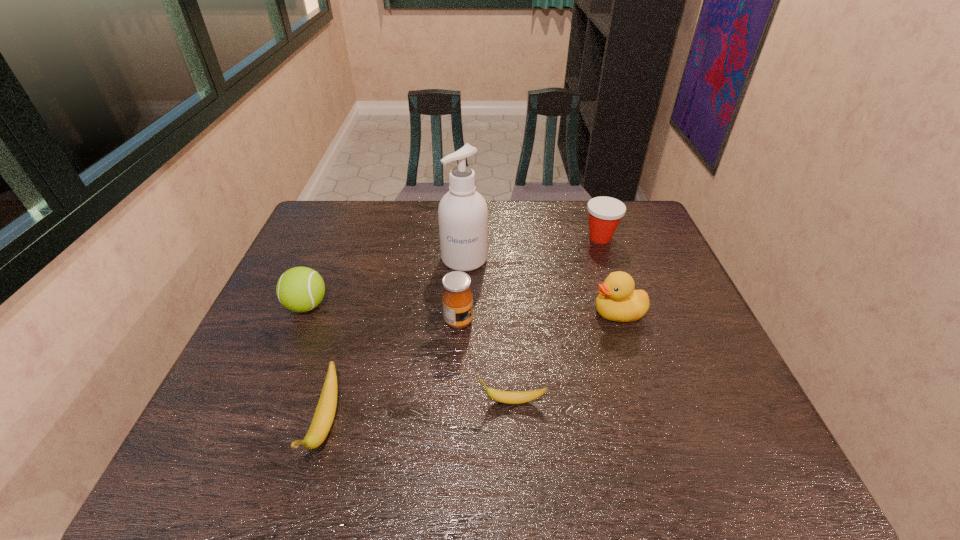
Locate an element on the screen. The height and width of the screenshot is (540, 960). object that is at the left edge is located at coordinates 299,289.

Locate an element on the screen. Dixie cup positioned at the right edge is located at coordinates (605, 213).

I want to click on duck that is at the right edge, so click(x=617, y=301).

The width and height of the screenshot is (960, 540). In order to click on object that is at the far right corner in this screenshot , I will do `click(605, 213)`.

Where is `vacant space at the far edge of the desktop`? The height and width of the screenshot is (540, 960). vacant space at the far edge of the desktop is located at coordinates (501, 239).

Locate an element on the screen. vacant area at the near edge is located at coordinates (564, 419).

Identify the location of vacant space at the left edge of the desktop. (340, 251).

At what (x,y) coordinates should I click in order to perform the action: click on empty space between the shorter banana and the duck. Please return your answer as a coordinate pair (x, y). Looking at the image, I should click on (564, 357).

The image size is (960, 540). I want to click on free space that is in between the right banana and the leftmost object, so click(x=409, y=353).

Identify the location of vacant area between the taller banana and the duck. The height and width of the screenshot is (540, 960). (471, 368).